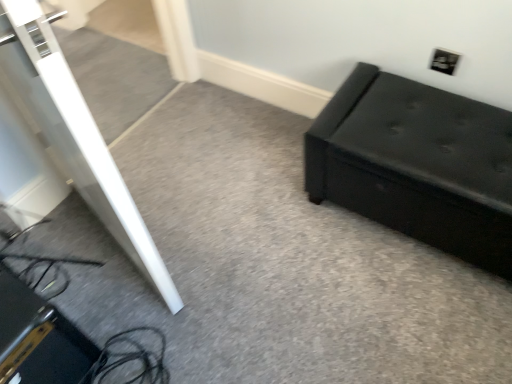
At what (x,y) coordinates should I click in order to perform the action: click on vacant area that is in front of black leather ottoman at right. Please return your answer as a coordinate pair (x, y). Looking at the image, I should click on [x=414, y=322].